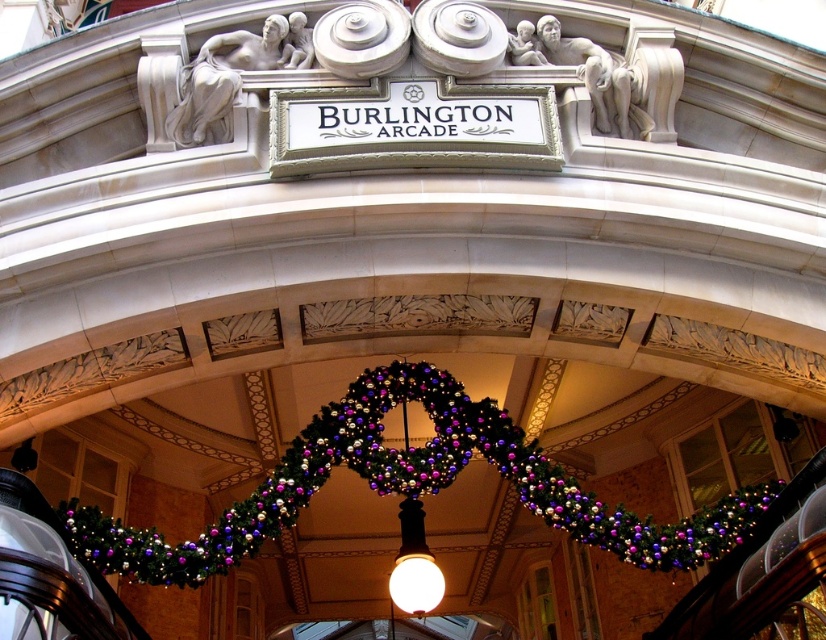
Is point (136, 580) positioned after point (418, 554)?

No.

Which of these two, green textured garland at center or matte white bulb at center, stands shorter?

Standing shorter between the two is green textured garland at center.

The image size is (826, 640). What are the coordinates of `green textured garland at center` in the screenshot? It's located at tap(411, 486).